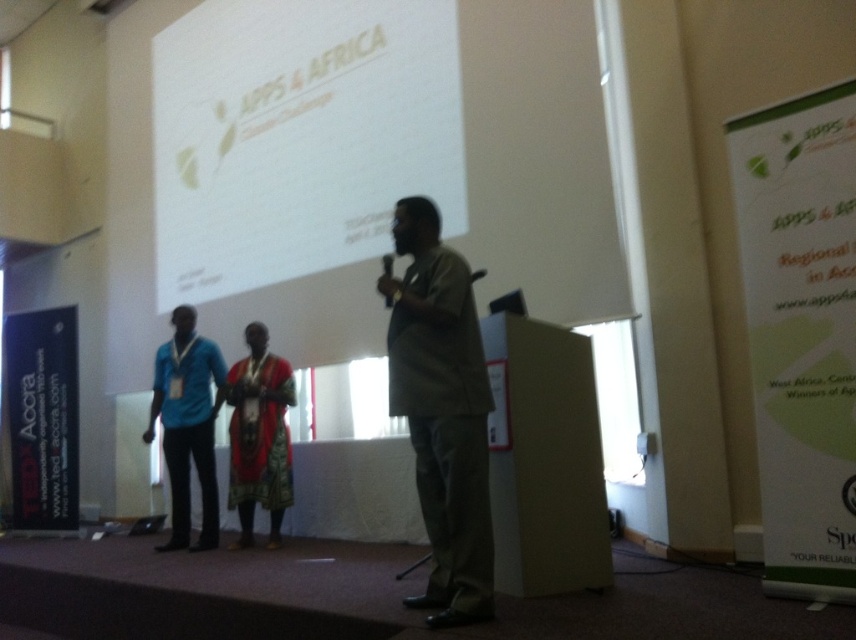
You are an event organizer who needs to ensure all attendees can see the stage clearly. The green fabric shirt at center and the textured red dress at center are both on the stage. Which of these two items is more likely to block the view of someone sitting in the front row?

The green fabric shirt at center is larger in size than the textured red dress at center, so it is more likely to block the view of someone sitting in the front row.

Based on the photo, what is the color of the fabric at the point with coordinates (443, 412)?

The point at coordinates (443, 412) is on the green fabric shirt at center.